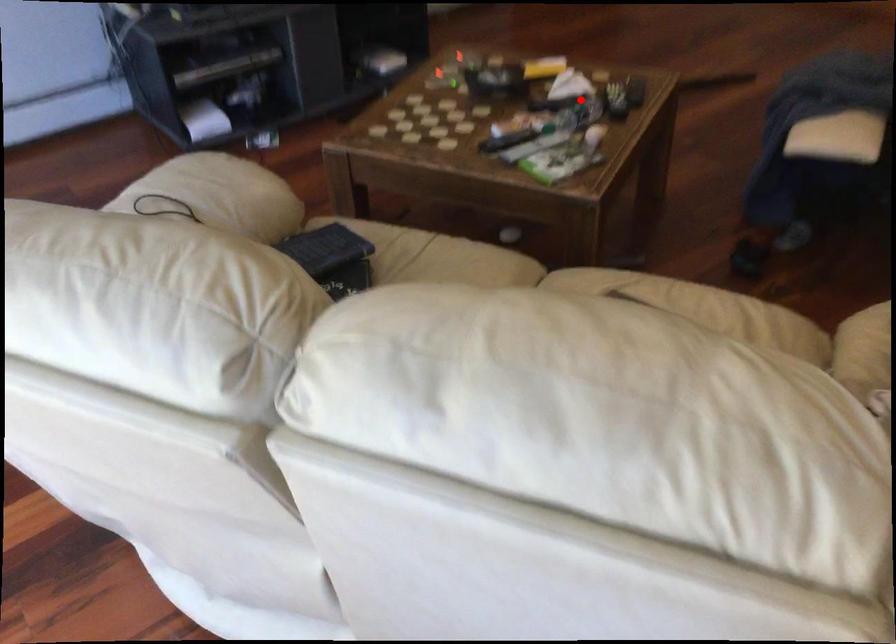
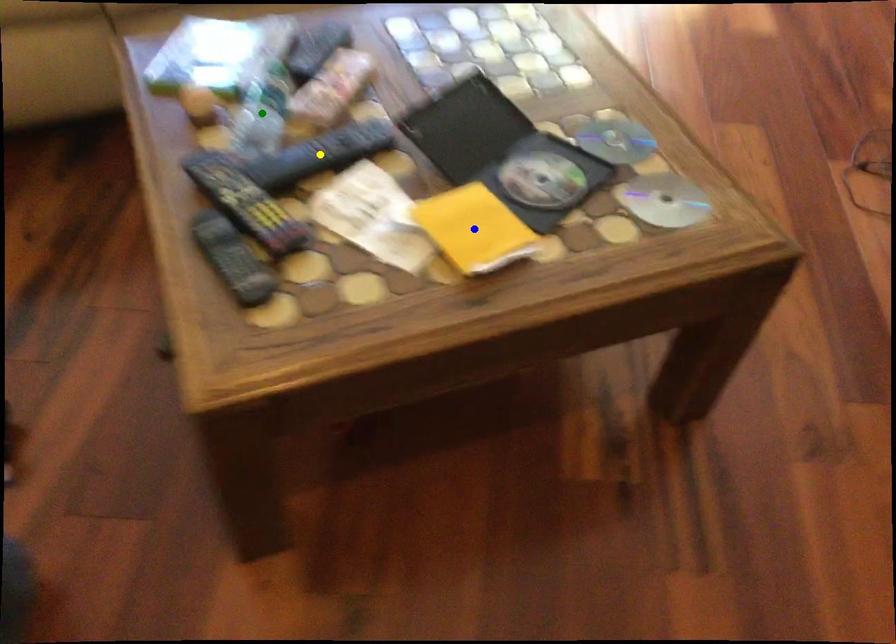
Question: I am providing you with two images of the same scene from different viewpoints. A red point is marked on the first image. You are given multiple points on the second image. Which point in image 2 represents the same 3d spot as the red point in image 1?

Choices:
 (A) yellow point
 (B) blue point
 (C) green point

Answer: (C)